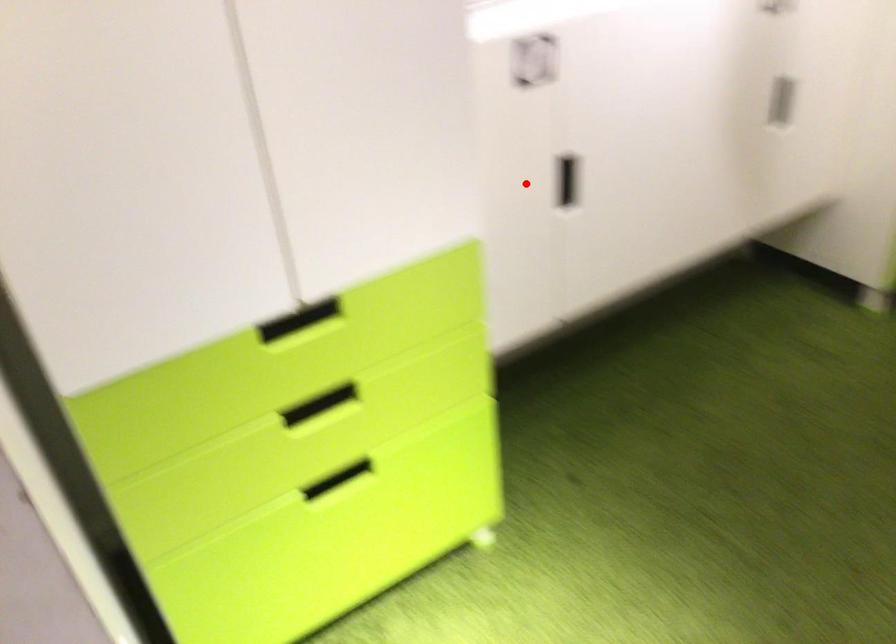
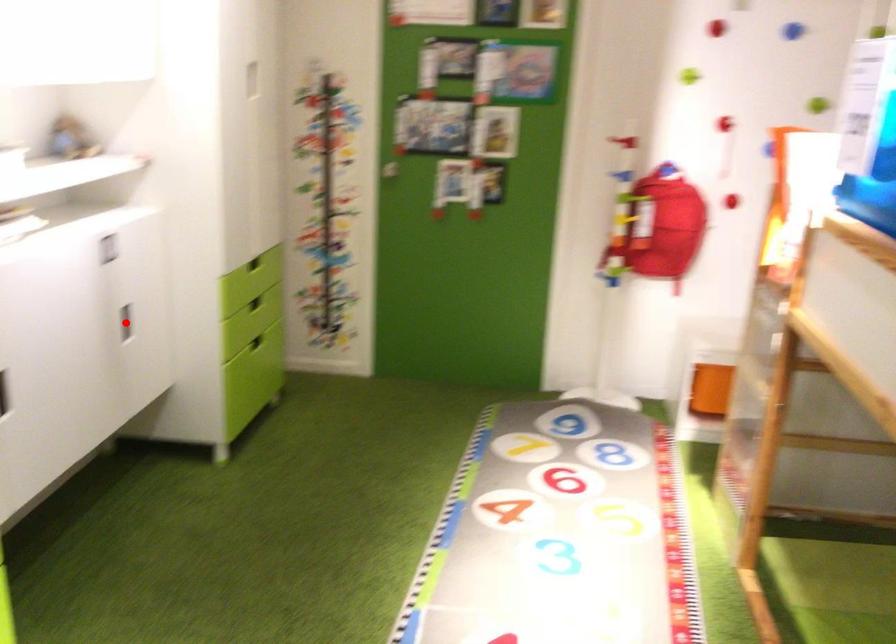
I am providing you with two images of the same scene from different viewpoints. A red point is marked on the first image and another point is marked on the second image. Does the point marked in image1 correspond to the same location as the one in image2?

No